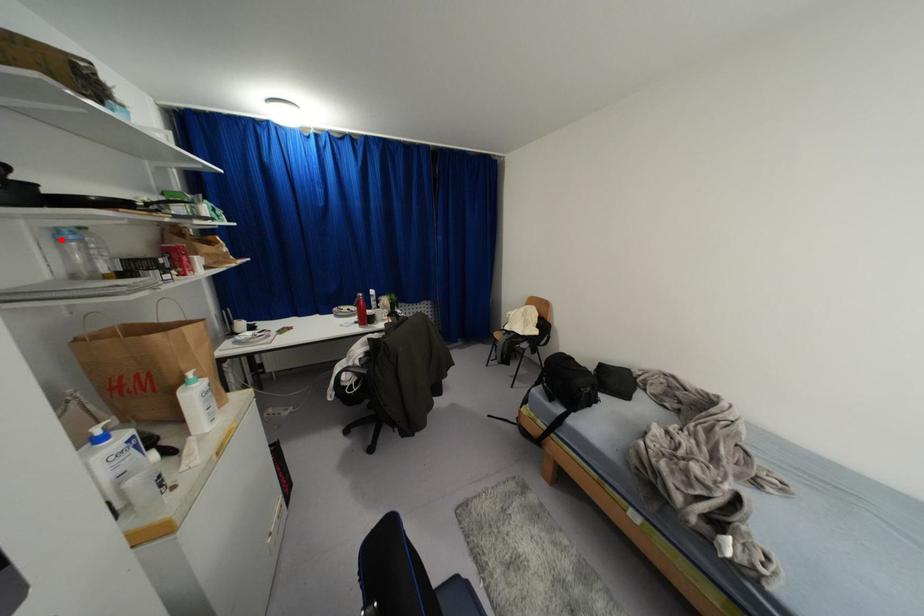
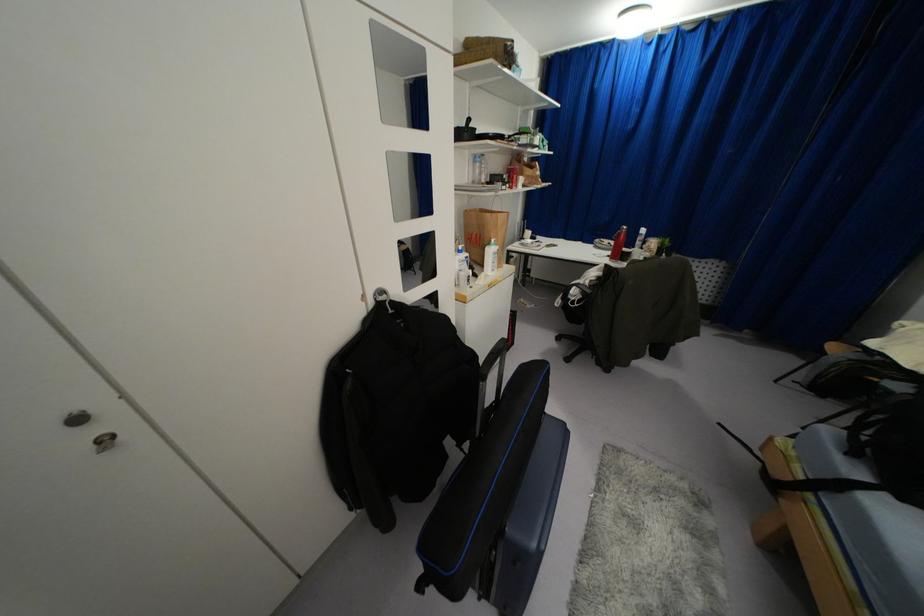
The point at the highlighted location is marked in the first image. Where is the corresponding point in the second image?

(475, 161)